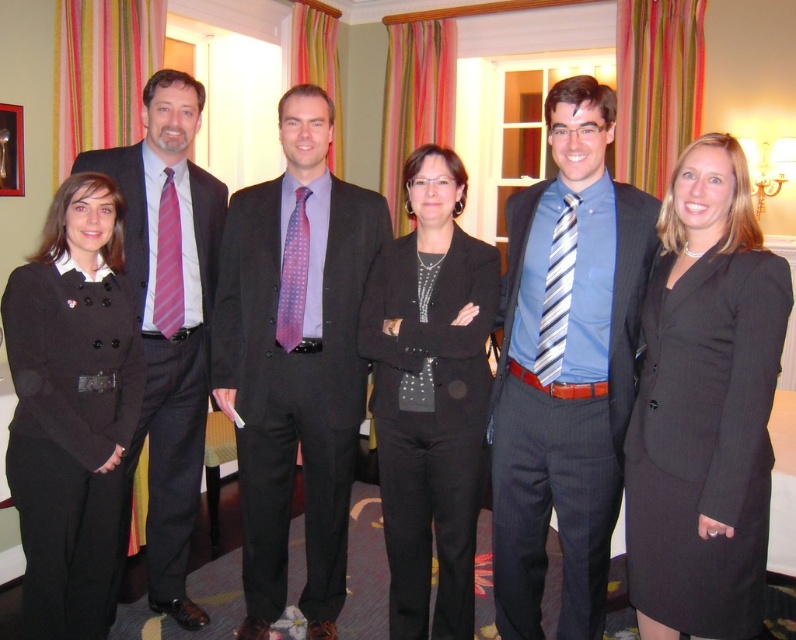
You are standing in the hotel room and want to take a photo of the group. The camera you have can only focus on objects within 2 meters. Is the point at coordinate (143, 388) within the camera focus range?

The point at coordinate (143, 388) is 2.49 meters from the camera, which is beyond the camera focus range of 2 meters. Therefore, the camera cannot focus on that point.

You are standing in the hotel room and want to move from the point at coordinates point(x=51, y=248) to the point at coordinates point(x=486, y=372). Which direction should you face to move towards the second point?

You should face towards the upper right direction to move from point(x=51, y=248) to point(x=486, y=372) since point(x=51, y=248) is in front of point(x=486, y=372).